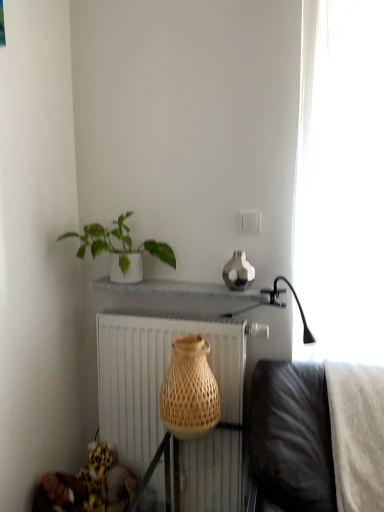
Question: Is white sheer curtain at right facing towards natural woven basket at center?

Choices:
 (A) no
 (B) yes

Answer: (A)

Question: From a real-world perspective, is white sheer curtain at right on top of natural woven basket at center?

Choices:
 (A) yes
 (B) no

Answer: (A)

Question: Does white sheer curtain at right have a greater width compared to natural woven basket at center?

Choices:
 (A) yes
 (B) no

Answer: (A)

Question: Does white sheer curtain at right have a lesser width compared to natural woven basket at center?

Choices:
 (A) no
 (B) yes

Answer: (A)

Question: Does white sheer curtain at right touch natural woven basket at center?

Choices:
 (A) yes
 (B) no

Answer: (B)

Question: Considering the positions of white sheer curtain at right and white matte radiator at center in the image, is white sheer curtain at right bigger or smaller than white matte radiator at center?

Choices:
 (A) small
 (B) big

Answer: (B)

Question: From their relative heights in the image, would you say white sheer curtain at right is taller or shorter than white matte radiator at center?

Choices:
 (A) tall
 (B) short

Answer: (A)

Question: From a real-world perspective, is white sheer curtain at right above or below white matte radiator at center?

Choices:
 (A) above
 (B) below

Answer: (A)

Question: Is white sheer curtain at right inside the boundaries of white matte radiator at center, or outside?

Choices:
 (A) outside
 (B) inside

Answer: (A)

Question: Does point (84, 233) appear closer or farther from the camera than point (357, 333)?

Choices:
 (A) closer
 (B) farther

Answer: (B)

Question: Would you say white ceramic plant at upper left is to the left or to the right of white sheer curtain at right in the picture?

Choices:
 (A) left
 (B) right

Answer: (A)

Question: From the image's perspective, is white ceramic plant at upper left above or below white sheer curtain at right?

Choices:
 (A) above
 (B) below

Answer: (B)

Question: Is white ceramic plant at upper left inside or outside of white sheer curtain at right?

Choices:
 (A) inside
 (B) outside

Answer: (B)

Question: From a real-world perspective, is white matte radiator at center physically located above or below white ceramic plant at upper left?

Choices:
 (A) below
 (B) above

Answer: (A)

Question: Is white matte radiator at center inside the boundaries of white ceramic plant at upper left, or outside?

Choices:
 (A) outside
 (B) inside

Answer: (A)